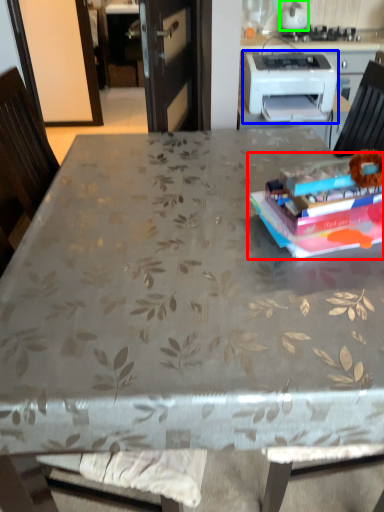
Question: Considering the real-world distances, which object is closest to paperback book (highlighted by a red box)? printer (highlighted by a blue box) or kitchen appliance (highlighted by a green box).

Choices:
 (A) printer
 (B) kitchen appliance

Answer: (A)